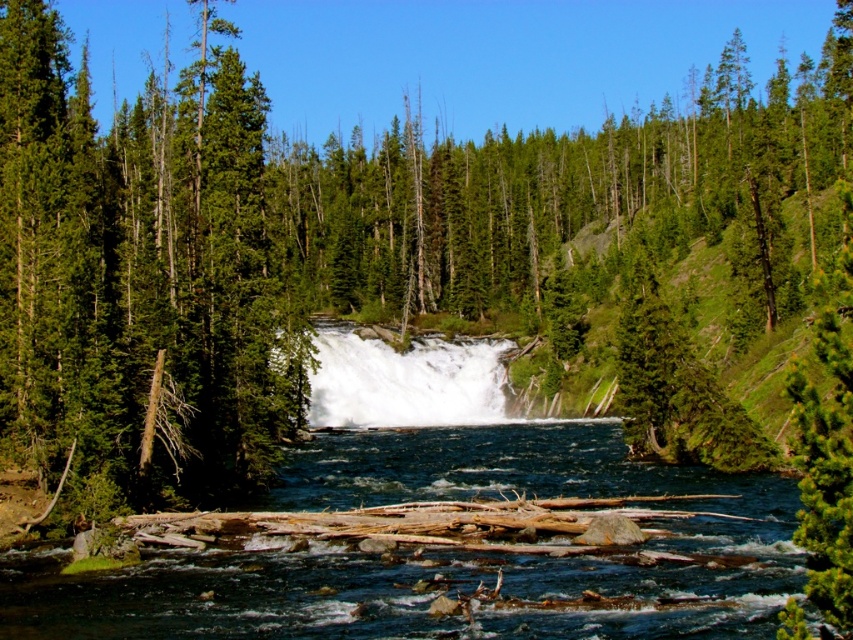
Question: Which point is farther from the camera taking this photo?

Choices:
 (A) (317, 401)
 (B) (759, 592)
 (C) (22, 460)

Answer: (A)

Question: Is green matte tree at left smaller than white frothy water at center?

Choices:
 (A) no
 (B) yes

Answer: (A)

Question: Which object is the closest to the white frothy water at center?

Choices:
 (A) clear blue water at center
 (B) green matte tree at left

Answer: (A)

Question: Where is green matte tree at left located in relation to clear blue water at center in the image?

Choices:
 (A) right
 (B) left

Answer: (B)

Question: Among these points, which one is farthest from the camera?

Choices:
 (A) (3, 12)
 (B) (341, 625)
 (C) (473, 358)

Answer: (C)

Question: Is green matte tree at left to the left of clear blue water at center from the viewer's perspective?

Choices:
 (A) yes
 (B) no

Answer: (A)